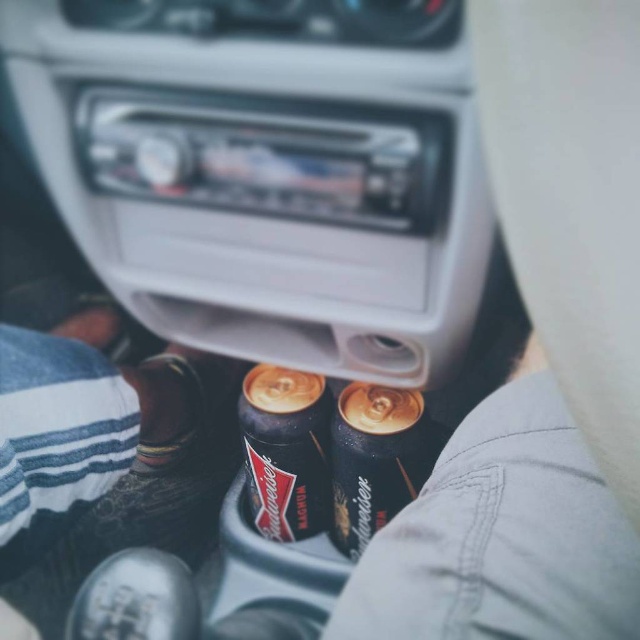
Between shiny black can at center and shiny gold can at center, which one is positioned lower?

shiny gold can at center

Does point (305, 404) come closer to viewer compared to point (413, 467)?

No, (305, 404) is further to viewer.

Image resolution: width=640 pixels, height=640 pixels. I want to click on shiny black can at center, so click(285, 451).